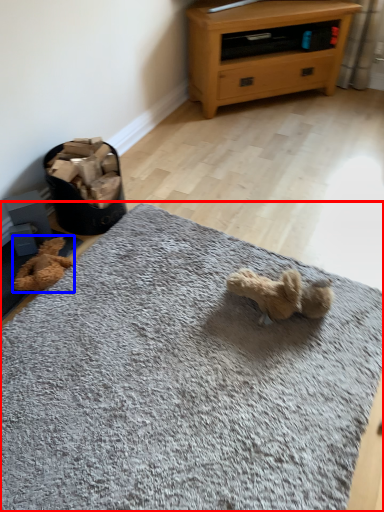
Question: Among these objects, which one is farthest to the camera, mat (highlighted by a red box) or teddy (highlighted by a blue box)?

Choices:
 (A) mat
 (B) teddy

Answer: (B)